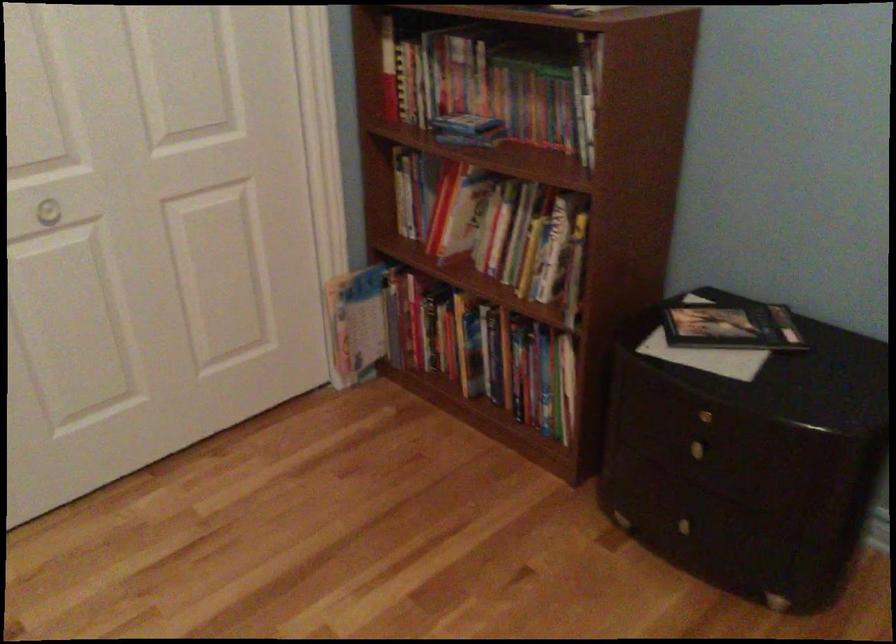
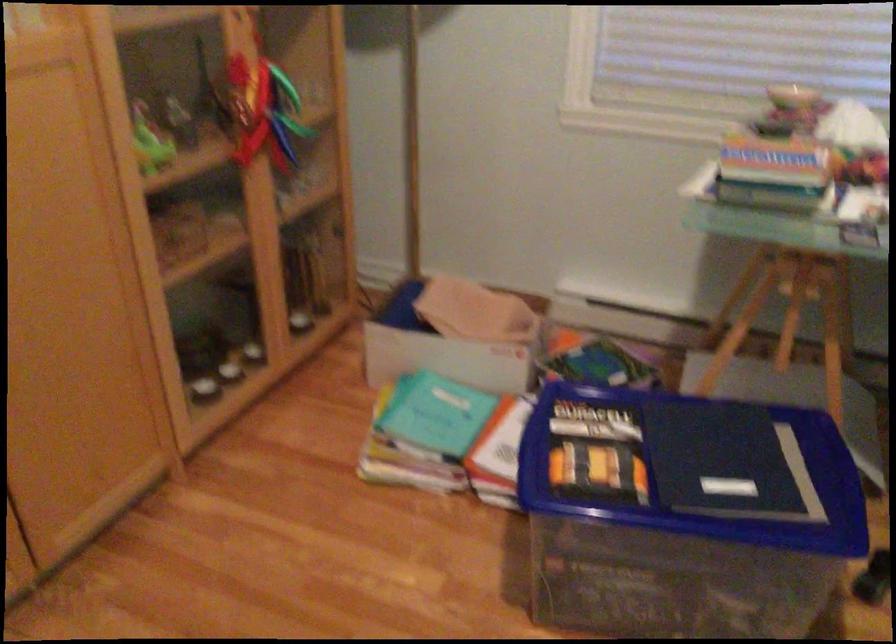
The images are taken continuously from a first-person perspective. In which direction is your viewpoint rotating?

The rotation direction of the camera is right-down.